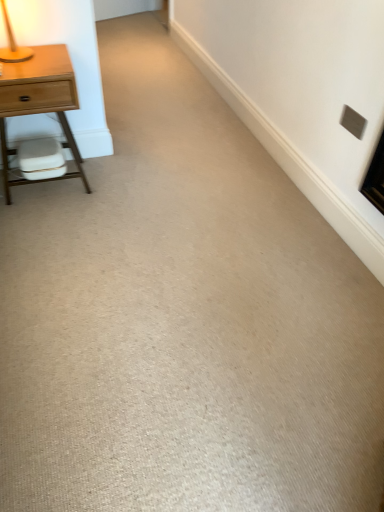
What is the approximate width of light wood/finish nightstand at left?

light wood/finish nightstand at left is 15.10 inches in width.

Identify the location of white matte swivel chair at left. (41, 159).

This screenshot has width=384, height=512. I want to click on gray matte electric outlet at upper right, so click(353, 122).

Locate an element on the screen. wooden table lamp at upper left is located at coordinates (13, 44).

Locate an element on the screen. light wood/finish nightstand at left is located at coordinates (39, 101).

Does light wood/finish nightstand at left have a smaller size compared to white matte swivel chair at left?

Actually, light wood/finish nightstand at left might be larger than white matte swivel chair at left.

Which of these two, light wood/finish nightstand at left or white matte swivel chair at left, stands shorter?

With less height is white matte swivel chair at left.

Locate an element on the screen. The width and height of the screenshot is (384, 512). nightstand above the white matte swivel chair at left (from a real-world perspective) is located at coordinates (39, 101).

Considering the positions of objects light wood/finish nightstand at left and white matte swivel chair at left in the image provided, who is more to the right, light wood/finish nightstand at left or white matte swivel chair at left?

white matte swivel chair at left is more to the right.

Does light wood/finish nightstand at left contain gray matte electric outlet at upper right?

Definitely not — gray matte electric outlet at upper right is not inside light wood/finish nightstand at left.

Measure the distance from light wood/finish nightstand at left to gray matte electric outlet at upper right.

light wood/finish nightstand at left is 4.07 feet away from gray matte electric outlet at upper right.

Would you say light wood/finish nightstand at left is a long distance from gray matte electric outlet at upper right?

Yes, light wood/finish nightstand at left and gray matte electric outlet at upper right are quite far apart.

Who is more distant, light wood/finish nightstand at left or gray matte electric outlet at upper right?

gray matte electric outlet at upper right is further from the camera.

In terms of height, does white matte swivel chair at left look taller or shorter compared to gray matte electric outlet at upper right?

Considering their sizes, white matte swivel chair at left has more height than gray matte electric outlet at upper right.

Can you tell me how much white matte swivel chair at left and gray matte electric outlet at upper right differ in facing direction?

The facing directions of white matte swivel chair at left and gray matte electric outlet at upper right are 89.1 degrees apart.

Locate an element on the screen. This screenshot has height=512, width=384. swivel chair that is behind the gray matte electric outlet at upper right is located at coordinates tap(41, 159).

Can you confirm if white matte swivel chair at left is positioned to the left of gray matte electric outlet at upper right?

Yes.

From the image's perspective, does white matte swivel chair at left appear higher than wooden table lamp at upper left?

No.

How different are the orientations of white matte swivel chair at left and wooden table lamp at upper left in degrees?

The angular difference between white matte swivel chair at left and wooden table lamp at upper left is 0.000439 degrees.

Which is closer, [63,168] or [4,61]?

The point [4,61] is in front.

Is white matte swivel chair at left completely or partially outside of wooden table lamp at upper left?

white matte swivel chair at left lies outside wooden table lamp at upper left's area.

Based on the photo, is the position of wooden table lamp at upper left less distant than that of white matte swivel chair at left?

Yes, the depth of wooden table lamp at upper left is less than that of white matte swivel chair at left.

Consider the image. Does wooden table lamp at upper left appear on the right side of white matte swivel chair at left?

In fact, wooden table lamp at upper left is to the left of white matte swivel chair at left.

In the scene shown: From the image's perspective, relative to white matte swivel chair at left, is wooden table lamp at upper left above or below?

From the image's perspective, wooden table lamp at upper left appears above white matte swivel chair at left.

Would you say wooden table lamp at upper left is inside or outside white matte swivel chair at left?

wooden table lamp at upper left cannot be found inside white matte swivel chair at left.

Which point is more distant from viewer, [54,147] or [59,87]?

Point [54,147]

From the image's perspective, between white matte swivel chair at left and light wood/finish nightstand at left, which one is located above?

light wood/finish nightstand at left appears higher in the image.

Considering the sizes of objects white matte swivel chair at left and light wood/finish nightstand at left in the image provided, who is bigger, white matte swivel chair at left or light wood/finish nightstand at left?

light wood/finish nightstand at left.

Based on the photo, is wooden table lamp at upper left next to light wood/finish nightstand at left and touching it?

wooden table lamp at upper left and light wood/finish nightstand at left are not in contact.

Is wooden table lamp at upper left inside or outside of light wood/finish nightstand at left?

wooden table lamp at upper left is located beyond the bounds of light wood/finish nightstand at left.

From the picture: Considering the relative sizes of wooden table lamp at upper left and light wood/finish nightstand at left in the image provided, is wooden table lamp at upper left shorter than light wood/finish nightstand at left?

Correct, wooden table lamp at upper left is not as tall as light wood/finish nightstand at left.

The width and height of the screenshot is (384, 512). In order to click on nightstand located above the white matte swivel chair at left (from the image's perspective) in this screenshot , I will do `click(39, 101)`.

The image size is (384, 512). In order to click on electric outlet below the light wood/finish nightstand at left (from the image's perspective) in this screenshot , I will do pos(353,122).

In the scene shown: Based on their spatial positions, is gray matte electric outlet at upper right or wooden table lamp at upper left closer to white matte swivel chair at left?

Based on the image, wooden table lamp at upper left appears to be nearer to white matte swivel chair at left.

Estimate the real-world distances between objects in this image. Which object is further from gray matte electric outlet at upper right, light wood/finish nightstand at left or wooden table lamp at upper left?

wooden table lamp at upper left lies further to gray matte electric outlet at upper right than the other object.

Based on their spatial positions, is wooden table lamp at upper left or light wood/finish nightstand at left closer to white matte swivel chair at left?

The object closer to white matte swivel chair at left is light wood/finish nightstand at left.

When comparing their distances from white matte swivel chair at left, does light wood/finish nightstand at left or wooden table lamp at upper left seem further?

wooden table lamp at upper left lies further to white matte swivel chair at left than the other object.

Considering their positions, is wooden table lamp at upper left positioned closer to light wood/finish nightstand at left than gray matte electric outlet at upper right?

wooden table lamp at upper left lies closer to light wood/finish nightstand at left than the other object.

When comparing their distances from gray matte electric outlet at upper right, does light wood/finish nightstand at left or white matte swivel chair at left seem further?

white matte swivel chair at left.

Considering their positions, is wooden table lamp at upper left positioned closer to white matte swivel chair at left than gray matte electric outlet at upper right?

wooden table lamp at upper left is closer to white matte swivel chair at left.

Which object lies nearer to the anchor point light wood/finish nightstand at left, gray matte electric outlet at upper right or wooden table lamp at upper left?

wooden table lamp at upper left is positioned closer to the anchor light wood/finish nightstand at left.

The height and width of the screenshot is (512, 384). What are the coordinates of `swivel chair situated between light wood/finish nightstand at left and gray matte electric outlet at upper right from left to right` in the screenshot? It's located at (41, 159).

The height and width of the screenshot is (512, 384). Find the location of `swivel chair situated between wooden table lamp at upper left and gray matte electric outlet at upper right from left to right`. swivel chair situated between wooden table lamp at upper left and gray matte electric outlet at upper right from left to right is located at coordinates (41, 159).

Locate an element on the screen. nightstand between wooden table lamp at upper left and white matte swivel chair at left from top to bottom is located at coordinates (39, 101).

At what (x,y) coordinates should I click in order to perform the action: click on table lamp situated between light wood/finish nightstand at left and gray matte electric outlet at upper right from left to right. Please return your answer as a coordinate pair (x, y). The width and height of the screenshot is (384, 512). Looking at the image, I should click on (13, 44).